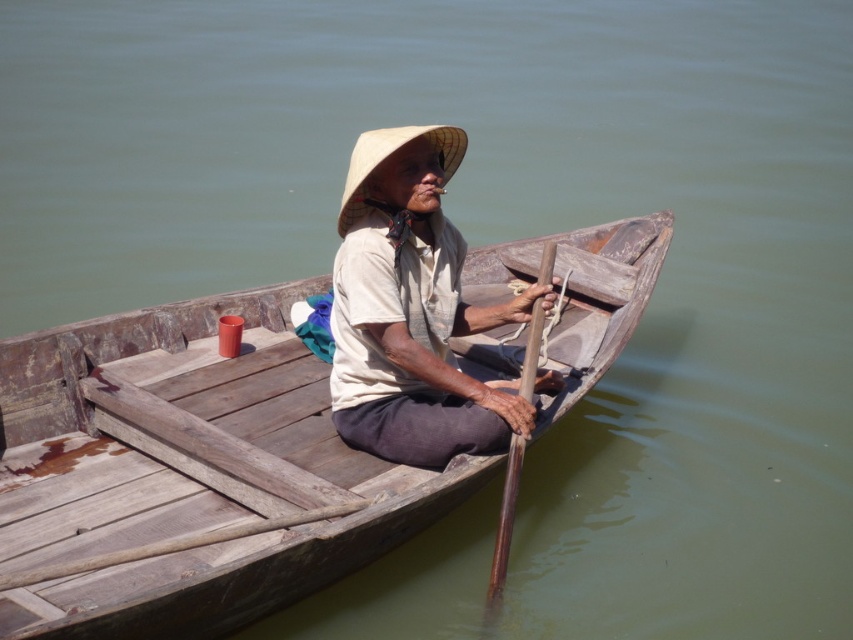
Question: Is wooden boat at center smaller than straw hat at center?

Choices:
 (A) yes
 (B) no

Answer: (B)

Question: Among these points, which one is farthest from the camera?

Choices:
 (A) (434, 141)
 (B) (492, 596)
 (C) (637, 224)

Answer: (C)

Question: Is wooden boat at center in front of white cotton shirt at center?

Choices:
 (A) no
 (B) yes

Answer: (B)

Question: Which of these objects is positioned closest to the wooden boat at center?

Choices:
 (A) white cotton shirt at center
 (B) brown wooden paddle at center
 (C) straw hat at center

Answer: (A)

Question: Which object appears farthest from the camera in this image?

Choices:
 (A) white cotton shirt at center
 (B) wooden boat at center
 (C) brown wooden paddle at center

Answer: (C)

Question: Is white cotton shirt at center thinner than straw hat at center?

Choices:
 (A) yes
 (B) no

Answer: (B)